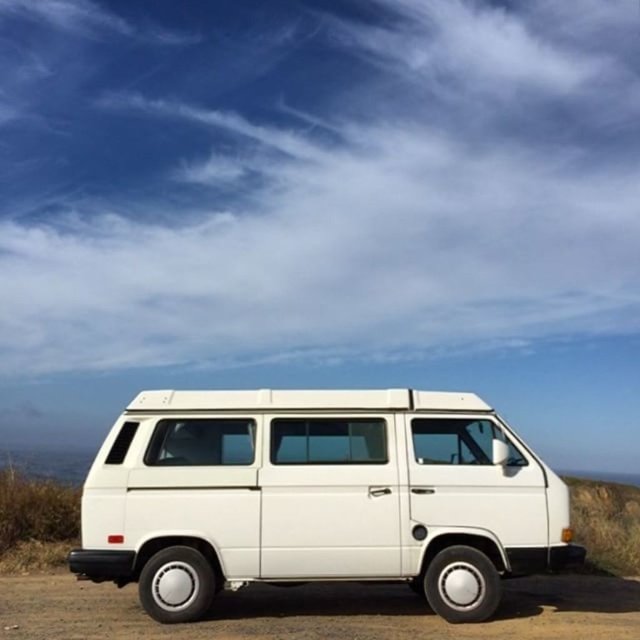
Who is more forward, (317, 540) or (369, 616)?

Point (317, 540)

Is white matte van at center to the left of white rubber tire at lower center from the viewer's perspective?

Indeed, white matte van at center is positioned on the left side of white rubber tire at lower center.

Image resolution: width=640 pixels, height=640 pixels. Identify the location of white matte van at center. (317, 497).